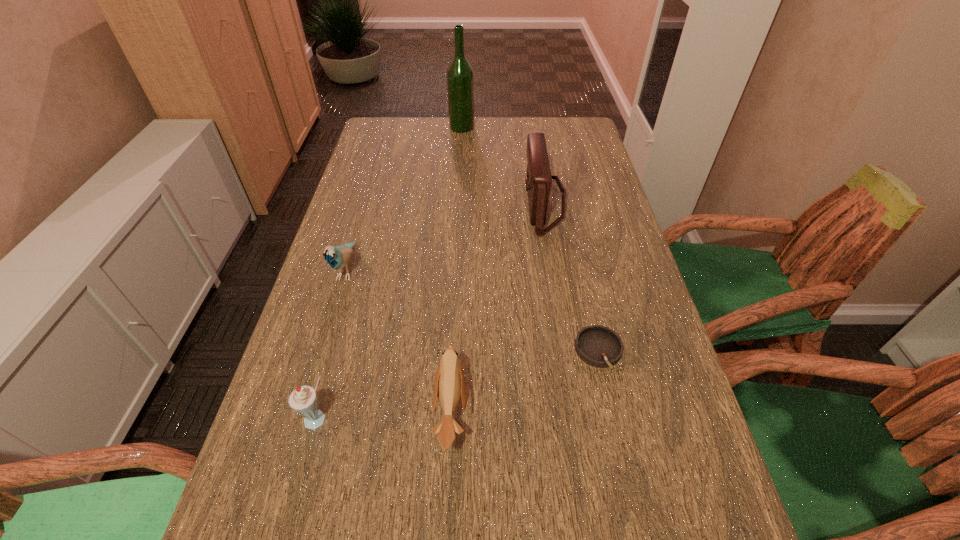
Identify the location of vacant space situated on the right of the tallest object. This screenshot has width=960, height=540. (543, 127).

The width and height of the screenshot is (960, 540). Identify the location of free space located 0.180m on the front flap of the second tallest object. (462, 202).

The width and height of the screenshot is (960, 540). Identify the location of free space located 0.220m on the front flap of the second tallest object. (448, 202).

The image size is (960, 540). Identify the location of blank space located 0.280m on the front flap of the second tallest object. (428, 202).

You are a GUI agent. You are given a task and a screenshot of the screen. Output one action in this format:
    pyautogui.click(x=<x>, y=<y>)
    Task: Click on the blank space located at the face of the farther bird
    
    Given the screenshot: What is the action you would take?
    pyautogui.click(x=289, y=461)

I want to click on free space located on the straw side of the milkshake, so click(x=295, y=509).

Locate an element on the screen. vacant area situated at the beak of the shorter bird is located at coordinates (553, 412).

What are the coordinates of `vacant point located on the left of the shortest object` in the screenshot? It's located at point(514,351).

Identify the location of object that is at the far edge. The width and height of the screenshot is (960, 540). (460, 77).

Find the location of a particular element. The height and width of the screenshot is (540, 960). bird located in the left edge section of the desktop is located at coordinates (337, 257).